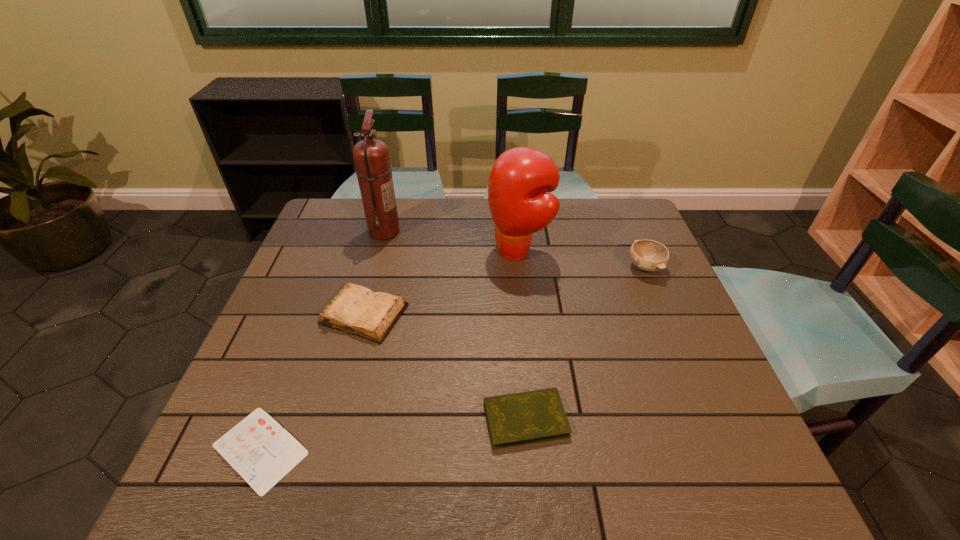
This screenshot has width=960, height=540. Identify the location of free point located 0.340m on the striking surface of the boxing glove. (372, 252).

Locate an element on the screen. The height and width of the screenshot is (540, 960). free region located 0.390m on the striking surface of the boxing glove is located at coordinates (356, 252).

Identify the location of vacant space located on the striking surface of the boxing glove. The height and width of the screenshot is (540, 960). (440, 252).

Find the location of a particular element. This screenshot has width=960, height=540. vacant space situated on the front of the fourth shortest object is located at coordinates (675, 338).

Find the location of `free space located 0.400m on the right of the farthest diary`. free space located 0.400m on the right of the farthest diary is located at coordinates pos(564,314).

At what (x,y) coordinates should I click in order to perform the action: click on free space located on the right of the rightmost diary. Please return your answer as a coordinate pair (x, y). The width and height of the screenshot is (960, 540). Looking at the image, I should click on (724, 419).

Locate an element on the screen. free spot located on the back of the shortest object is located at coordinates (288, 376).

I want to click on fire extinguisher at the far edge, so [x=371, y=156].

Locate an element on the screen. The height and width of the screenshot is (540, 960). boxing glove that is at the far edge is located at coordinates (520, 177).

At what (x,y) coordinates should I click in order to perform the action: click on object at the near edge. Please return your answer as a coordinate pair (x, y). This screenshot has height=540, width=960. Looking at the image, I should click on (262, 452).